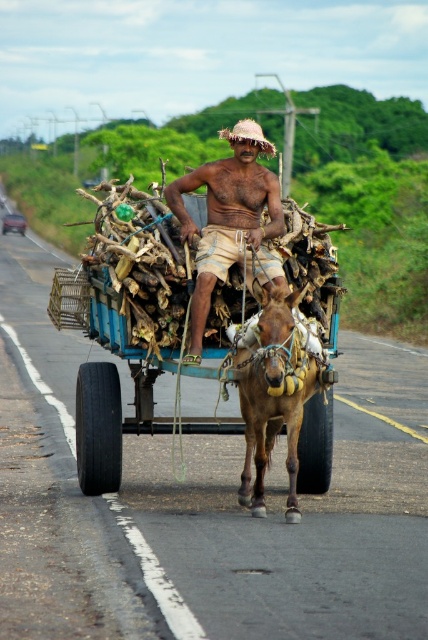
This screenshot has width=428, height=640. What do you see at coordinates (231, 221) in the screenshot?
I see `brown textured shorts at center` at bounding box center [231, 221].

Does brown textured shorts at center lie in front of brown leather donkey at center?

No, brown textured shorts at center is further to the viewer.

Between point (202, 268) and point (241, 369), which one is positioned in front?

Point (241, 369)

Locate an element on the screen. The image size is (428, 640). brown textured shorts at center is located at coordinates (231, 221).

Who is more distant from viewer, (x=327, y=330) or (x=190, y=221)?

Positioned behind is point (x=327, y=330).

Between blue painted wood horse cart at center and brown textured shorts at center, which one has more height?

blue painted wood horse cart at center is taller.

Who is more forward, (x=127, y=225) or (x=237, y=248)?

Point (x=237, y=248) is more forward.

The height and width of the screenshot is (640, 428). I want to click on blue painted wood horse cart at center, so click(x=128, y=326).

Is blue painted wood horse cart at center positioned at the back of brown leather donkey at center?

Yes, it is behind brown leather donkey at center.

Is point (222, 301) in front of point (246, 381)?

That is False.

Where is `blue painted wood horse cart at center`? The width and height of the screenshot is (428, 640). blue painted wood horse cart at center is located at coordinates (128, 326).